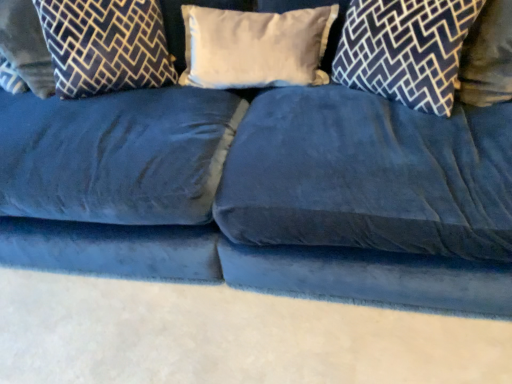
What do you see at coordinates (26, 46) in the screenshot? The height and width of the screenshot is (384, 512). I see `velvet-patterned pillow at left, which ranks as the 1th pillow in left-to-right order` at bounding box center [26, 46].

Locate an element on the screen. The width and height of the screenshot is (512, 384). white soft pillow at center, which ranks as the 3th pillow in left-to-right order is located at coordinates click(255, 47).

Describe the element at coordinates (405, 50) in the screenshot. This screenshot has width=512, height=384. I see `dark blue velvet pillow at upper right, which is the 1th pillow from right to left` at that location.

Image resolution: width=512 pixels, height=384 pixels. I want to click on velvet-patterned pillow at left, which ranks as the 1th pillow in left-to-right order, so click(x=26, y=46).

Does dark blue velvet pillow at upper right, which appears as the fourth pillow when viewed from the left, lie behind dark blue velvet pillow at upper left, the 2th pillow from the left?

No, it is not.

Does dark blue velvet pillow at upper right, which appears as the fourth pillow when viewed from the left, turn towards dark blue velvet pillow at upper left, placed as the 3th pillow when sorted from right to left?

No, dark blue velvet pillow at upper right, which appears as the fourth pillow when viewed from the left, is not facing towards dark blue velvet pillow at upper left, placed as the 3th pillow when sorted from right to left.

How many degrees apart are the facing directions of dark blue velvet pillow at upper right, which is the 1th pillow from right to left, and dark blue velvet pillow at upper left, placed as the 3th pillow when sorted from right to left?

There is a 0.0106-degree angle between the facing directions of dark blue velvet pillow at upper right, which is the 1th pillow from right to left, and dark blue velvet pillow at upper left, placed as the 3th pillow when sorted from right to left.

This screenshot has width=512, height=384. What are the coordinates of `the 1st pillow behind the dark blue velvet pillow at upper right, which appears as the fourth pillow when viewed from the left` in the screenshot? It's located at (105, 45).

Between velvet-patterned pillow at left, positioned as the fourth pillow in right-to-left order, and dark blue velvet pillow at upper right, which appears as the fourth pillow when viewed from the left, which one has more height?

With more height is velvet-patterned pillow at left, positioned as the fourth pillow in right-to-left order.

From the image's perspective, between velvet-patterned pillow at left, positioned as the fourth pillow in right-to-left order, and dark blue velvet pillow at upper right, which is the 1th pillow from right to left, who is located below?

dark blue velvet pillow at upper right, which is the 1th pillow from right to left.

Is velvet-patterned pillow at left, which ranks as the 1th pillow in left-to-right order, aimed at dark blue velvet pillow at upper right, which appears as the fourth pillow when viewed from the left?

No, velvet-patterned pillow at left, which ranks as the 1th pillow in left-to-right order, is not oriented towards dark blue velvet pillow at upper right, which appears as the fourth pillow when viewed from the left.

Can you confirm if velvet-patterned pillow at left, which ranks as the 1th pillow in left-to-right order, is positioned to the left of dark blue velvet pillow at upper right, which is the 1th pillow from right to left?

Yes.

Looking at this image, can you tell me how much dark blue velvet pillow at upper left, the 2th pillow from the left, and velvet-patterned pillow at left, positioned as the fourth pillow in right-to-left order, differ in facing direction?

There is a 0.000228-degree angle between the facing directions of dark blue velvet pillow at upper left, the 2th pillow from the left, and velvet-patterned pillow at left, positioned as the fourth pillow in right-to-left order.

From their relative heights in the image, would you say dark blue velvet pillow at upper left, placed as the 3th pillow when sorted from right to left, is taller or shorter than velvet-patterned pillow at left, positioned as the fourth pillow in right-to-left order?

dark blue velvet pillow at upper left, placed as the 3th pillow when sorted from right to left, is shorter than velvet-patterned pillow at left, positioned as the fourth pillow in right-to-left order.

From a real-world perspective, does dark blue velvet pillow at upper left, the 2th pillow from the left, stand above velvet-patterned pillow at left, which ranks as the 1th pillow in left-to-right order?

Correct, in the physical world, dark blue velvet pillow at upper left, the 2th pillow from the left, is higher than velvet-patterned pillow at left, which ranks as the 1th pillow in left-to-right order.

Is dark blue velvet pillow at upper left, placed as the 3th pillow when sorted from right to left, positioned far away from velvet-patterned pillow at left, which ranks as the 1th pillow in left-to-right order?

No, there isn't a large distance between dark blue velvet pillow at upper left, placed as the 3th pillow when sorted from right to left, and velvet-patterned pillow at left, which ranks as the 1th pillow in left-to-right order.

From a real-world perspective, which is physically above, velvet-patterned pillow at left, which ranks as the 1th pillow in left-to-right order, or white soft pillow at center, which is counted as the second pillow, starting from the right?

velvet-patterned pillow at left, which ranks as the 1th pillow in left-to-right order, is physically above.

Which is less distant, (41, 80) or (236, 72)?

The point (236, 72) is closer.

Is velvet-patterned pillow at left, which ranks as the 1th pillow in left-to-right order, not close to white soft pillow at center, which is counted as the second pillow, starting from the right?

That's not correct — velvet-patterned pillow at left, which ranks as the 1th pillow in left-to-right order, is a little close to white soft pillow at center, which is counted as the second pillow, starting from the right.

How different are the orientations of velvet-patterned pillow at left, which ranks as the 1th pillow in left-to-right order, and white soft pillow at center, which ranks as the 3th pillow in left-to-right order, in degrees?

The angular difference between velvet-patterned pillow at left, which ranks as the 1th pillow in left-to-right order, and white soft pillow at center, which ranks as the 3th pillow in left-to-right order, is 0.0106 degrees.

Who is shorter, white soft pillow at center, which ranks as the 3th pillow in left-to-right order, or dark blue velvet pillow at upper left, the 2th pillow from the left?

Standing shorter between the two is white soft pillow at center, which ranks as the 3th pillow in left-to-right order.

From the image's perspective, which pillow is the 1st one above the white soft pillow at center, which ranks as the 3th pillow in left-to-right order? Please provide its 2D coordinates.

[(105, 45)]

Between white soft pillow at center, which ranks as the 3th pillow in left-to-right order, and dark blue velvet pillow at upper left, the 2th pillow from the left, which one has larger width?

dark blue velvet pillow at upper left, the 2th pillow from the left.

Considering the relative sizes of white soft pillow at center, which is counted as the second pillow, starting from the right, and dark blue velvet pillow at upper left, the 2th pillow from the left, in the image provided, is white soft pillow at center, which is counted as the second pillow, starting from the right, bigger than dark blue velvet pillow at upper left, the 2th pillow from the left,?

No.

Is white soft pillow at center, which ranks as the 3th pillow in left-to-right order, smaller than dark blue velvet pillow at upper right, which appears as the fourth pillow when viewed from the left?

Yes.

From a real-world perspective, is white soft pillow at center, which is counted as the second pillow, starting from the right, over dark blue velvet pillow at upper right, which is the 1th pillow from right to left?

Actually, white soft pillow at center, which is counted as the second pillow, starting from the right, is physically below dark blue velvet pillow at upper right, which is the 1th pillow from right to left, in the real world.

Is white soft pillow at center, which ranks as the 3th pillow in left-to-right order, to the right of dark blue velvet pillow at upper right, which appears as the fourth pillow when viewed from the left, from the viewer's perspective?

No.

Which is in front, white soft pillow at center, which is counted as the second pillow, starting from the right, or dark blue velvet pillow at upper right, which appears as the fourth pillow when viewed from the left?

dark blue velvet pillow at upper right, which appears as the fourth pillow when viewed from the left, is in front.

From the image's perspective, which is above, dark blue velvet pillow at upper left, the 2th pillow from the left, or white soft pillow at center, which ranks as the 3th pillow in left-to-right order?

dark blue velvet pillow at upper left, the 2th pillow from the left.

Is dark blue velvet pillow at upper left, the 2th pillow from the left, bigger or smaller than white soft pillow at center, which is counted as the second pillow, starting from the right?

dark blue velvet pillow at upper left, the 2th pillow from the left, is bigger than white soft pillow at center, which is counted as the second pillow, starting from the right.

In the scene shown: Which point is more forward, (154,18) or (199,12)?

The point (154,18) is in front.

Looking at this image, is dark blue velvet pillow at upper left, placed as the 3th pillow when sorted from right to left, surrounding white soft pillow at center, which ranks as the 3th pillow in left-to-right order?

No, white soft pillow at center, which ranks as the 3th pillow in left-to-right order, is located outside of dark blue velvet pillow at upper left, placed as the 3th pillow when sorted from right to left.

Find the location of a particular element. Image resolution: width=512 pixels, height=384 pixels. pillow lying in front of the dark blue velvet pillow at upper left, placed as the 3th pillow when sorted from right to left is located at coordinates (405, 50).

Where is `the 3rd pillow to the right of the velvet-patterned pillow at left, which ranks as the 1th pillow in left-to-right order, counting from the anchor's position`? This screenshot has height=384, width=512. the 3rd pillow to the right of the velvet-patterned pillow at left, which ranks as the 1th pillow in left-to-right order, counting from the anchor's position is located at coordinates (405, 50).

Which object lies further to the anchor point white soft pillow at center, which is counted as the second pillow, starting from the right, dark blue velvet pillow at upper left, the 2th pillow from the left, or dark blue velvet pillow at upper right, which is the 1th pillow from right to left?

dark blue velvet pillow at upper left, the 2th pillow from the left.

Based on their spatial positions, is dark blue velvet pillow at upper right, which appears as the fourth pillow when viewed from the left, or dark blue velvet pillow at upper left, placed as the 3th pillow when sorted from right to left, closer to velvet-patterned pillow at left, positioned as the fourth pillow in right-to-left order?

The object closer to velvet-patterned pillow at left, positioned as the fourth pillow in right-to-left order, is dark blue velvet pillow at upper left, placed as the 3th pillow when sorted from right to left.

Based on their spatial positions, is white soft pillow at center, which is counted as the second pillow, starting from the right, or dark blue velvet pillow at upper right, which appears as the fourth pillow when viewed from the left, closer to velvet-patterned pillow at left, which ranks as the 1th pillow in left-to-right order?

white soft pillow at center, which is counted as the second pillow, starting from the right, lies closer to velvet-patterned pillow at left, which ranks as the 1th pillow in left-to-right order, than the other object.

Estimate the real-world distances between objects in this image. Which object is further from dark blue velvet pillow at upper right, which appears as the fourth pillow when viewed from the left, dark blue velvet pillow at upper left, placed as the 3th pillow when sorted from right to left, or velvet-patterned pillow at left, which ranks as the 1th pillow in left-to-right order?

velvet-patterned pillow at left, which ranks as the 1th pillow in left-to-right order, is positioned further to the anchor dark blue velvet pillow at upper right, which appears as the fourth pillow when viewed from the left.

From the image, which object appears to be nearer to dark blue velvet pillow at upper left, the 2th pillow from the left, velvet-patterned pillow at left, which ranks as the 1th pillow in left-to-right order, or dark blue velvet pillow at upper right, which appears as the fourth pillow when viewed from the left?

velvet-patterned pillow at left, which ranks as the 1th pillow in left-to-right order.

Considering their positions, is dark blue velvet pillow at upper right, which is the 1th pillow from right to left, positioned closer to white soft pillow at center, which ranks as the 3th pillow in left-to-right order, than dark blue velvet pillow at upper left, the 2th pillow from the left?

The object closer to white soft pillow at center, which ranks as the 3th pillow in left-to-right order, is dark blue velvet pillow at upper right, which is the 1th pillow from right to left.

Estimate the real-world distances between objects in this image. Which object is closer to dark blue velvet pillow at upper left, the 2th pillow from the left, white soft pillow at center, which ranks as the 3th pillow in left-to-right order, or dark blue velvet pillow at upper right, which appears as the fourth pillow when viewed from the left?

The object closer to dark blue velvet pillow at upper left, the 2th pillow from the left, is white soft pillow at center, which ranks as the 3th pillow in left-to-right order.

Considering their positions, is dark blue velvet pillow at upper right, which appears as the fourth pillow when viewed from the left, positioned closer to dark blue velvet pillow at upper left, placed as the 3th pillow when sorted from right to left, than white soft pillow at center, which is counted as the second pillow, starting from the right?

The object closer to dark blue velvet pillow at upper left, placed as the 3th pillow when sorted from right to left, is white soft pillow at center, which is counted as the second pillow, starting from the right.

I want to click on pillow located between dark blue velvet pillow at upper left, the 2th pillow from the left, and dark blue velvet pillow at upper right, which is the 1th pillow from right to left, in the left-right direction, so (x=255, y=47).

In order to click on pillow located between velvet-patterned pillow at left, positioned as the fourth pillow in right-to-left order, and white soft pillow at center, which is counted as the second pillow, starting from the right, in the left-right direction in this screenshot , I will do `click(105, 45)`.